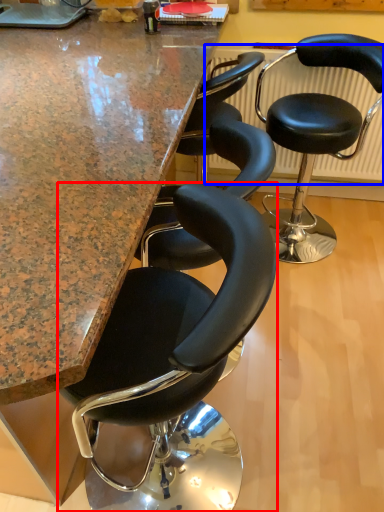
Question: Which object is further to the camera taking this photo, chair (highlighted by a red box) or radiator (highlighted by a blue box)?

Choices:
 (A) chair
 (B) radiator

Answer: (B)